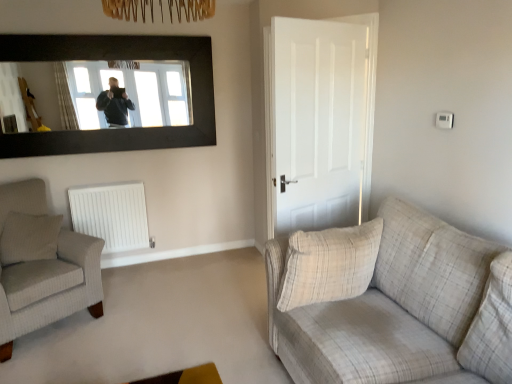
The height and width of the screenshot is (384, 512). I want to click on vacant space to the right of light gray fabric armchair at left, so click(150, 308).